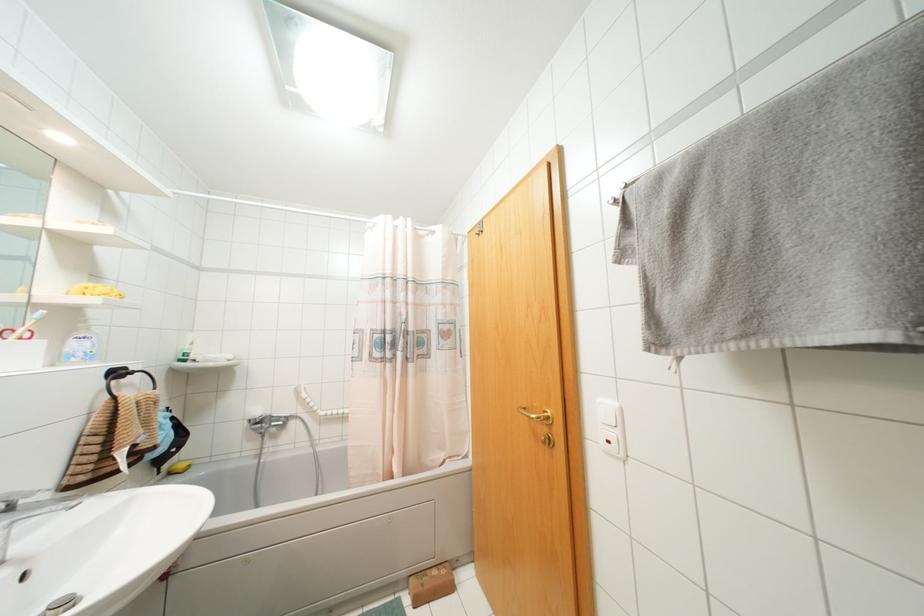
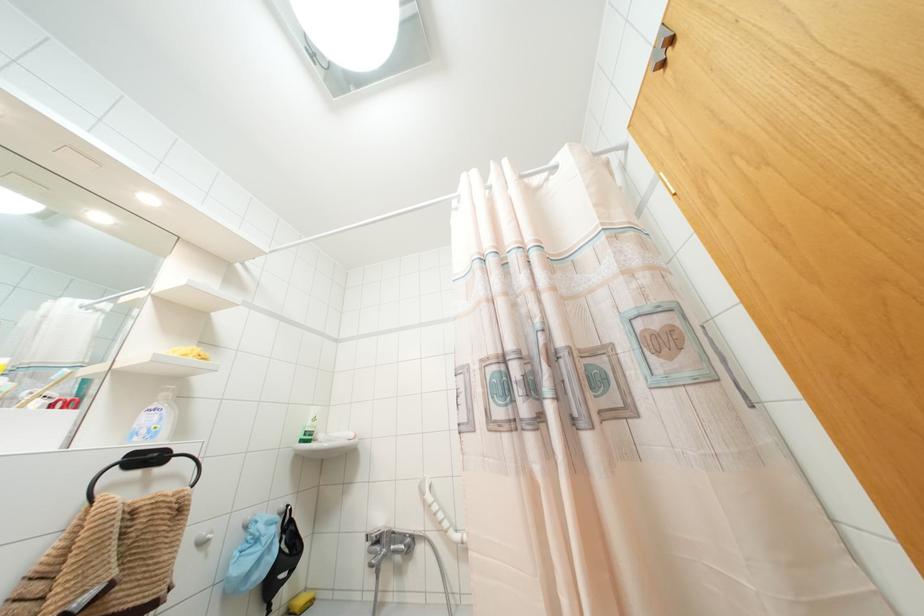
How did the camera likely rotate?

The camera rotated toward left-up.